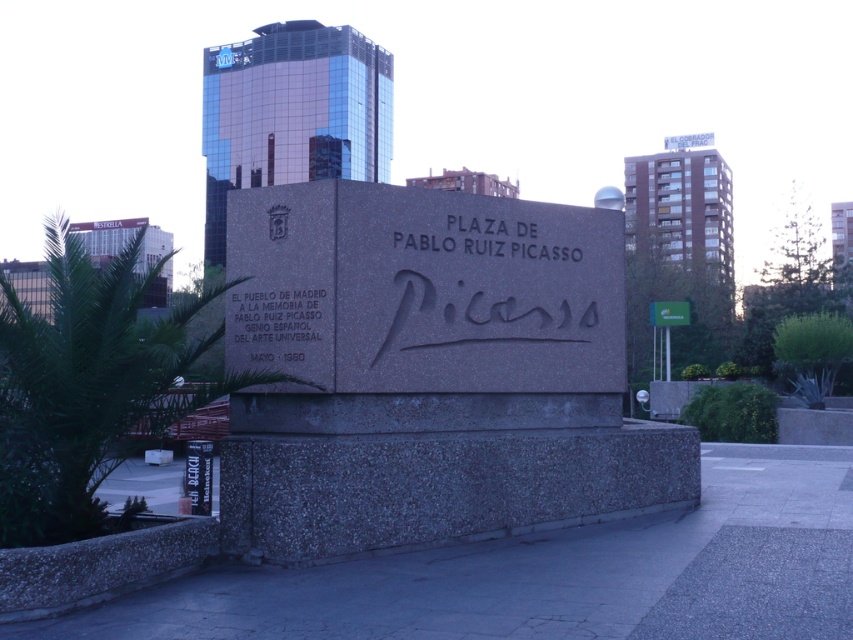
Question: Which point is closer to the camera?

Choices:
 (A) matte stone inscription at center
 (B) gray granite sign at center

Answer: (B)

Question: Which point is farther to the camera?

Choices:
 (A) (303, 330)
 (B) (309, 454)

Answer: (A)

Question: Which point is farther to the camera?

Choices:
 (A) gray granite sign at center
 (B) matte stone inscription at center

Answer: (B)

Question: Does gray granite sign at center have a greater width compared to matte stone inscription at center?

Choices:
 (A) yes
 (B) no

Answer: (A)

Question: Can you confirm if gray granite sign at center is bigger than matte stone inscription at center?

Choices:
 (A) no
 (B) yes

Answer: (B)

Question: Considering the relative positions of gray granite sign at center and matte stone inscription at center in the image provided, where is gray granite sign at center located with respect to matte stone inscription at center?

Choices:
 (A) below
 (B) above

Answer: (A)